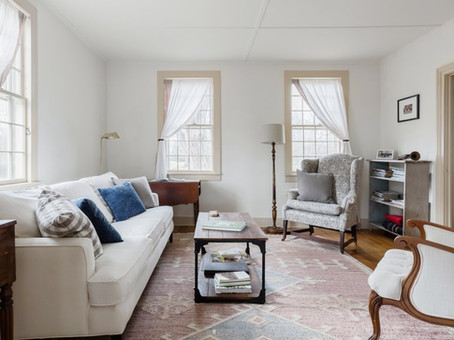
This screenshot has height=340, width=454. Identify the location of book shelf. (412, 194).